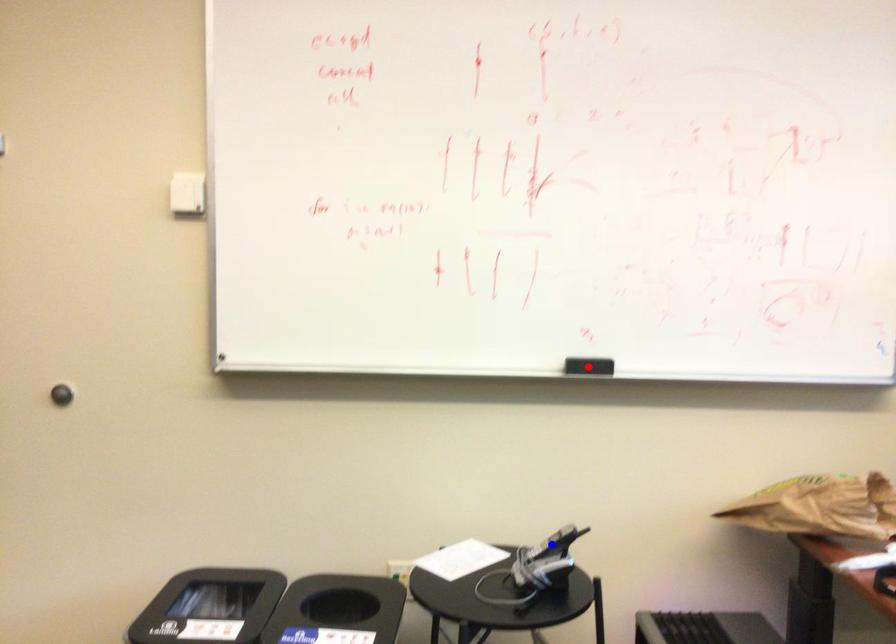
Question: In the image, two points are highlighted. Which point is nearer to the camera? Reply with the corresponding letter.

Choices:
 (A) blue point
 (B) red point

Answer: (A)